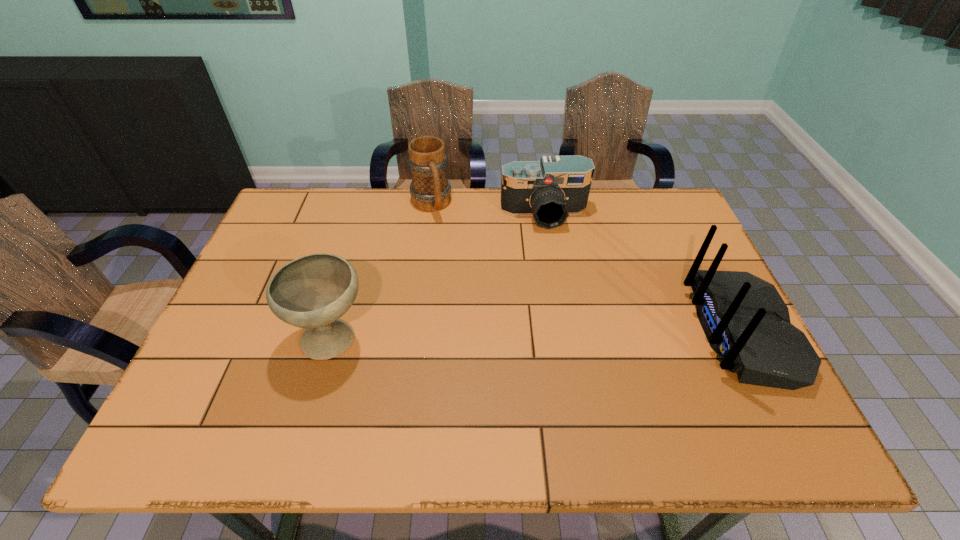
I want to click on free space between the chalice and the mug, so click(382, 272).

Locate an element on the screen. The width and height of the screenshot is (960, 540). vacant area between the camera and the rightmost object is located at coordinates (643, 273).

The height and width of the screenshot is (540, 960). I want to click on free spot between the shortest object and the leftmost object, so click(x=439, y=276).

What are the coordinates of `free space between the mug and the rightmost object` in the screenshot? It's located at (587, 268).

I want to click on free space between the router and the shortest object, so click(x=643, y=273).

Where is `free space between the camera and the leftmost object`? The height and width of the screenshot is (540, 960). free space between the camera and the leftmost object is located at coordinates (439, 276).

The image size is (960, 540). Find the location of `vacant point located between the mug and the router`. vacant point located between the mug and the router is located at coordinates click(x=587, y=268).

Select which object is the second closest to the second object from left to right. Please provide its 2D coordinates. Your answer should be formatted as a tuple, i.e. [(x, y)], where the tuple contains the x and y coordinates of a point satisfying the conditions above.

[(312, 292)]

The width and height of the screenshot is (960, 540). Identify the location of object that is the third nearest to the rightmost object. (312, 292).

I want to click on vacant area that satisfies the following two spatial constraints: 1. on the front side of the second object from left to right; 2. on the back of the router, so point(415,331).